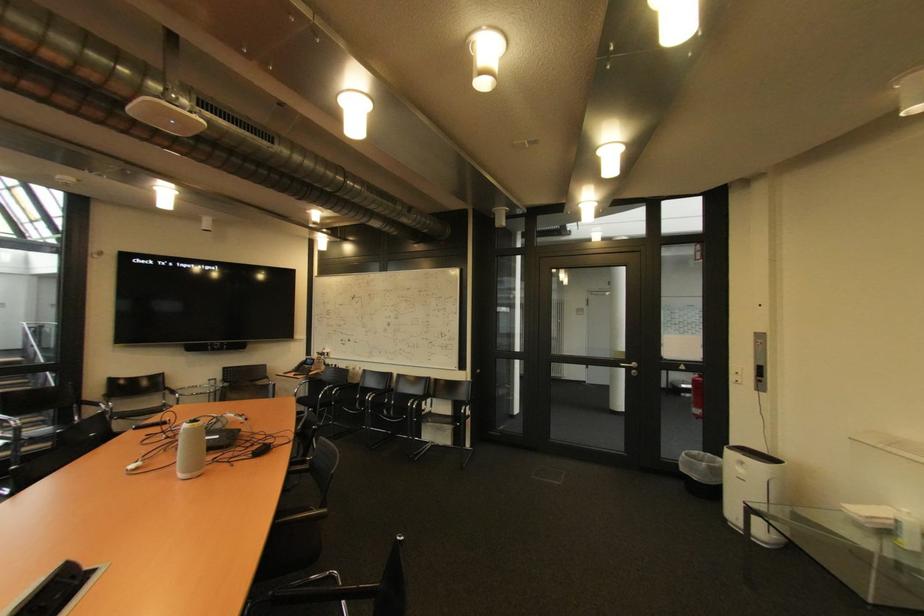
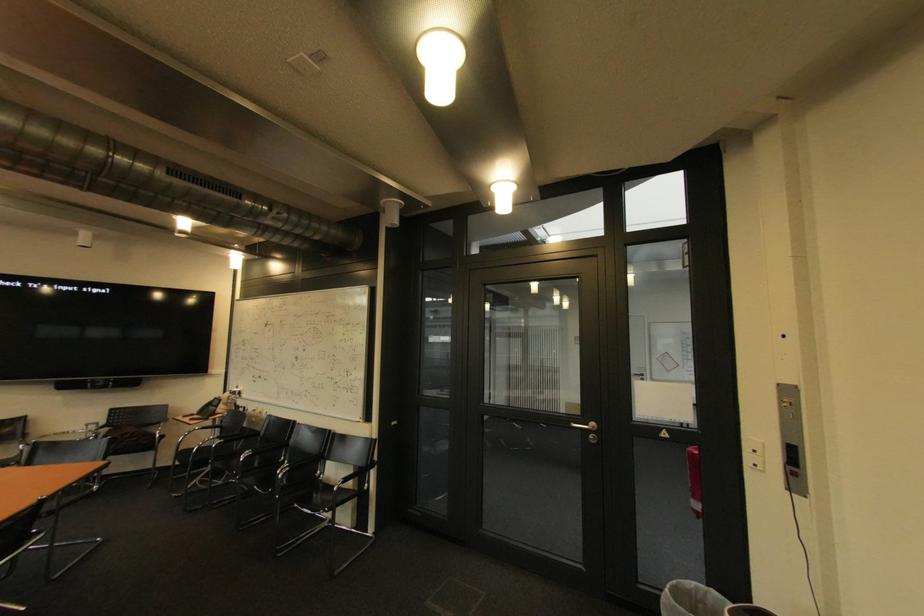
Locate, in the second image, the point that corresponds to [742,379] in the first image.

(757, 459)